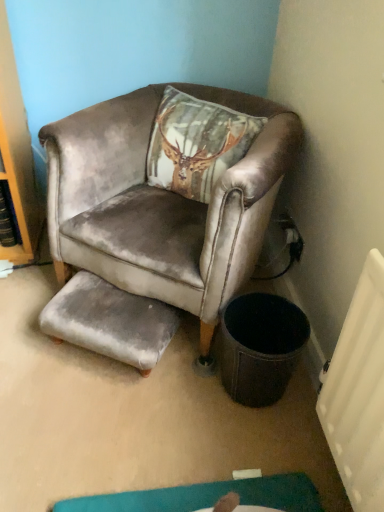
Question: Is the depth of velvet brown armchair at upper center greater than that of gray velvet footrest at lower center?

Choices:
 (A) no
 (B) yes

Answer: (A)

Question: Does velvet brown armchair at upper center have a lesser width compared to gray velvet footrest at lower center?

Choices:
 (A) no
 (B) yes

Answer: (A)

Question: From a real-world perspective, does velvet brown armchair at upper center stand above gray velvet footrest at lower center?

Choices:
 (A) no
 (B) yes

Answer: (B)

Question: Does velvet brown armchair at upper center appear on the right side of gray velvet footrest at lower center?

Choices:
 (A) yes
 (B) no

Answer: (A)

Question: Is velvet brown armchair at upper center touching gray velvet footrest at lower center?

Choices:
 (A) yes
 (B) no

Answer: (B)

Question: Can you confirm if velvet brown armchair at upper center is wider than gray velvet footrest at lower center?

Choices:
 (A) no
 (B) yes

Answer: (B)

Question: Can you confirm if gray velvet footrest at lower center is positioned to the right of velvet brown armchair at upper center?

Choices:
 (A) yes
 (B) no

Answer: (B)

Question: Is gray velvet footrest at lower center turned away from velvet brown armchair at upper center?

Choices:
 (A) yes
 (B) no

Answer: (A)

Question: Does gray velvet footrest at lower center have a greater width compared to velvet brown armchair at upper center?

Choices:
 (A) yes
 (B) no

Answer: (B)

Question: From the image's perspective, does gray velvet footrest at lower center appear higher than velvet brown armchair at upper center?

Choices:
 (A) no
 (B) yes

Answer: (A)

Question: Is gray velvet footrest at lower center facing towards velvet brown armchair at upper center?

Choices:
 (A) no
 (B) yes

Answer: (A)

Question: Is gray velvet footrest at lower center shorter than velvet brown armchair at upper center?

Choices:
 (A) no
 (B) yes

Answer: (B)

Question: From the image's perspective, relative to velvet brown armchair at upper center, is gray velvet footrest at lower center above or below?

Choices:
 (A) above
 (B) below

Answer: (B)